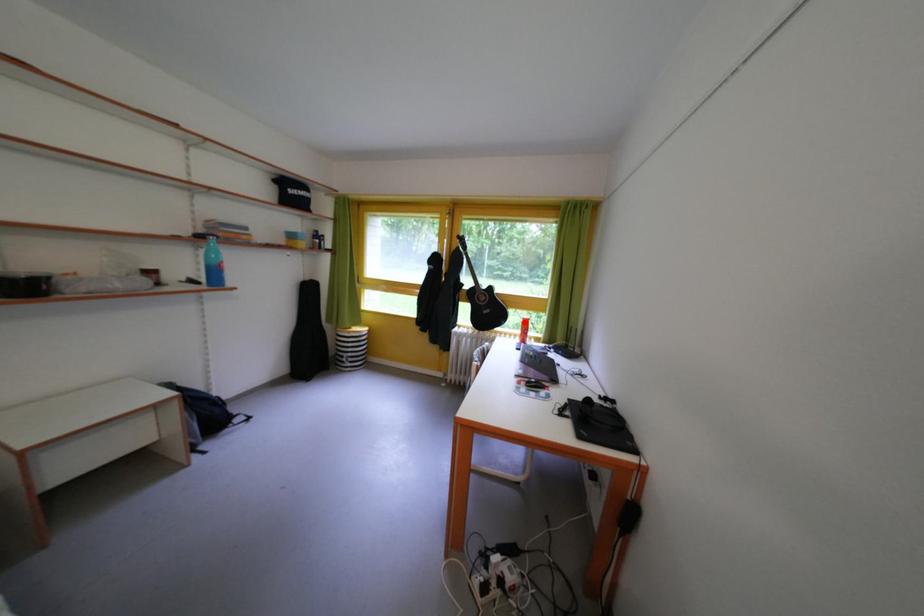
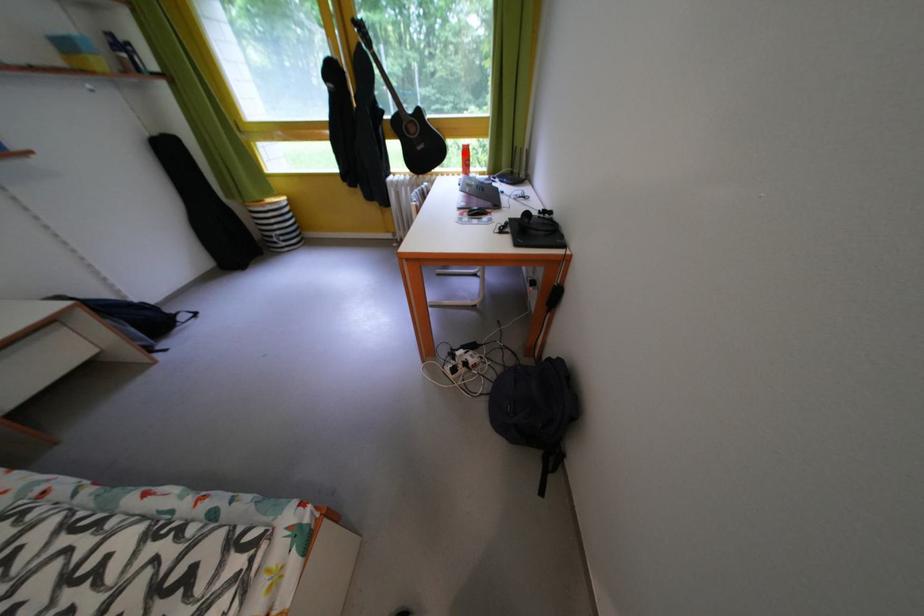
I am providing you with two images of the same scene from different viewpoints. A red point is marked on the first image and another point is marked on the second image. Does the point marked in image1 correspond to the same location as the one in image2?

Yes